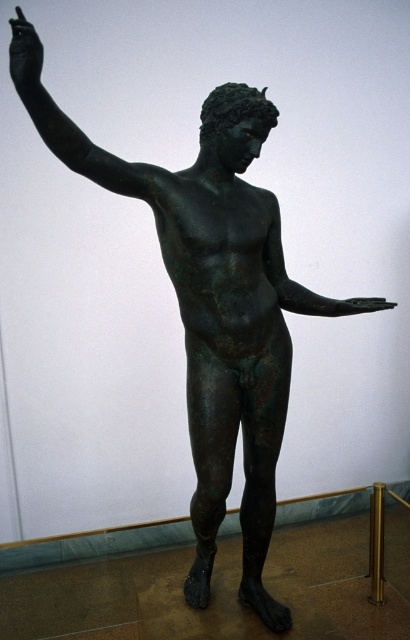
Who is lower down, bronze arm at upper left or bronze statue hand at upper left?

bronze arm at upper left

Who is more forward, (47, 104) or (22, 67)?

Point (22, 67) is in front.

Does point (131, 188) lie behind point (15, 45)?

Yes, it is behind point (15, 45).

Identify the location of bronze arm at upper left. Image resolution: width=410 pixels, height=640 pixels. (70, 124).

Is bronze arm at center to the right of bronze statue hand at upper left from the viewer's perspective?

Correct, you'll find bronze arm at center to the right of bronze statue hand at upper left.

Measure the distance between bronze arm at center and bronze statue hand at upper left.

bronze arm at center is 33.49 inches from bronze statue hand at upper left.

The height and width of the screenshot is (640, 410). Describe the element at coordinates (298, 284) in the screenshot. I see `bronze arm at center` at that location.

Identify the location of bronze arm at center. The height and width of the screenshot is (640, 410). (298, 284).

Is bronze arm at center closer to camera compared to bronze hand at center?

No, bronze arm at center is behind bronze hand at center.

What do you see at coordinates (298, 284) in the screenshot?
I see `bronze arm at center` at bounding box center [298, 284].

Find the location of a particular element. bronze arm at center is located at coordinates (298, 284).